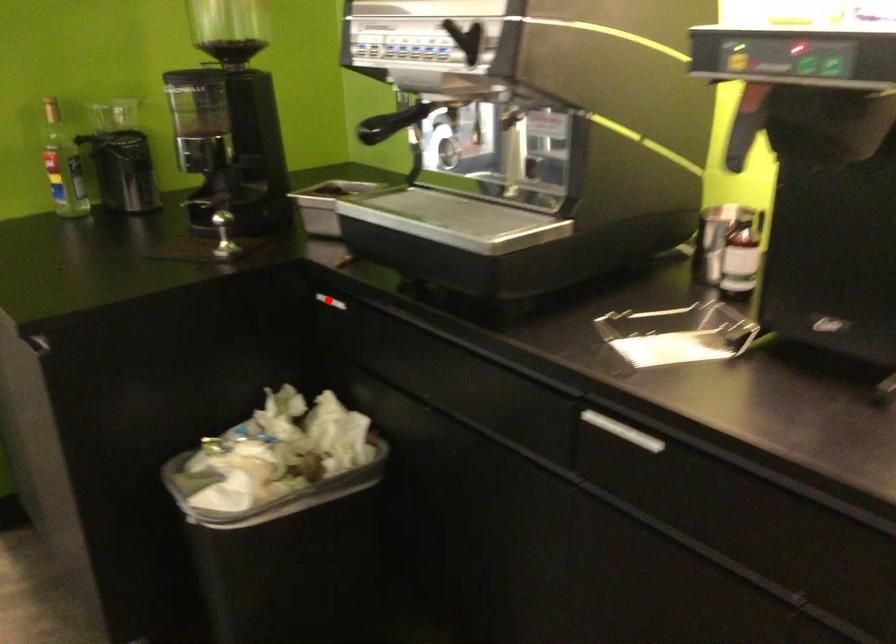
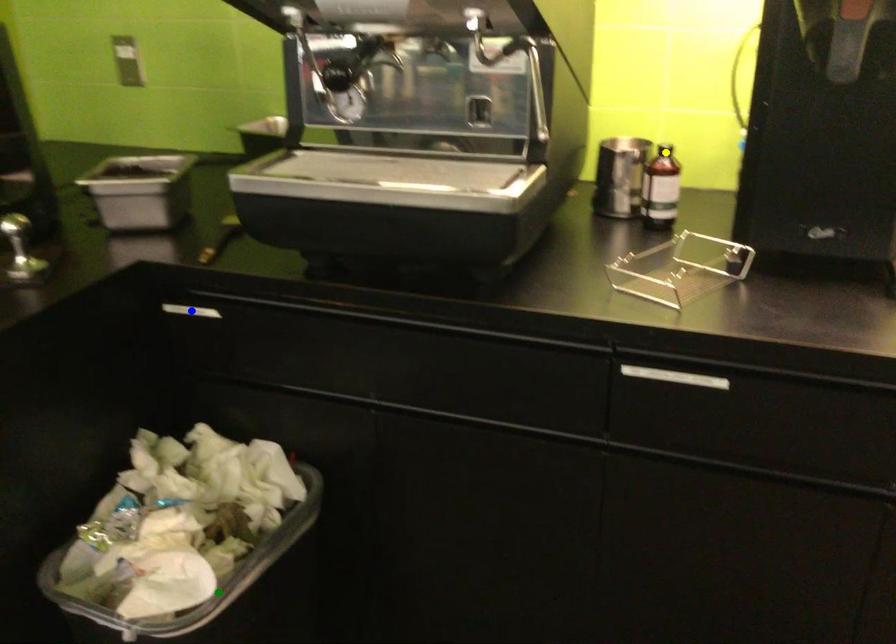
Question: I am providing you with two images of the same scene from different viewpoints. A red point is marked on the first image. You are given multiple points on the second image. In image 2, which mark is for the same physical point as the one in image 1?

Choices:
 (A) green point
 (B) yellow point
 (C) blue point

Answer: (C)